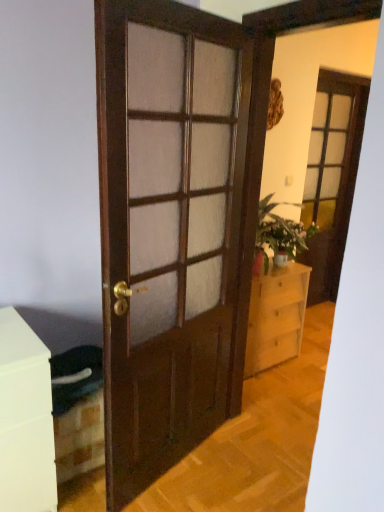
Question: Are wooden door at center and light wood chest of drawers at center located far from each other?

Choices:
 (A) no
 (B) yes

Answer: (A)

Question: From a real-world perspective, is wooden door at center located higher than light wood chest of drawers at center?

Choices:
 (A) no
 (B) yes

Answer: (B)

Question: Can you confirm if wooden door at center is positioned to the right of light wood chest of drawers at center?

Choices:
 (A) no
 (B) yes

Answer: (A)

Question: Is wooden door at center further to the viewer compared to light wood chest of drawers at center?

Choices:
 (A) no
 (B) yes

Answer: (A)

Question: From the image's perspective, is wooden door at center under light wood chest of drawers at center?

Choices:
 (A) no
 (B) yes

Answer: (A)

Question: Can you confirm if wooden door at center is bigger than light wood chest of drawers at center?

Choices:
 (A) no
 (B) yes

Answer: (A)

Question: From a real-world perspective, is matte pink vase at center-right beneath matte glass screen door at upper right?

Choices:
 (A) yes
 (B) no

Answer: (A)

Question: Can you confirm if matte pink vase at center-right is shorter than matte glass screen door at upper right?

Choices:
 (A) yes
 (B) no

Answer: (A)

Question: Is matte pink vase at center-right beside matte glass screen door at upper right?

Choices:
 (A) yes
 (B) no

Answer: (B)

Question: Is matte glass screen door at upper right inside matte pink vase at center-right?

Choices:
 (A) no
 (B) yes

Answer: (A)

Question: Is matte pink vase at center-right positioned before matte glass screen door at upper right?

Choices:
 (A) no
 (B) yes

Answer: (B)

Question: Is matte pink vase at center-right to the left of matte glass screen door at upper right from the viewer's perspective?

Choices:
 (A) yes
 (B) no

Answer: (A)

Question: Is light wood chest of drawers at center closer to camera compared to matte pink vase at center-right?

Choices:
 (A) yes
 (B) no

Answer: (A)